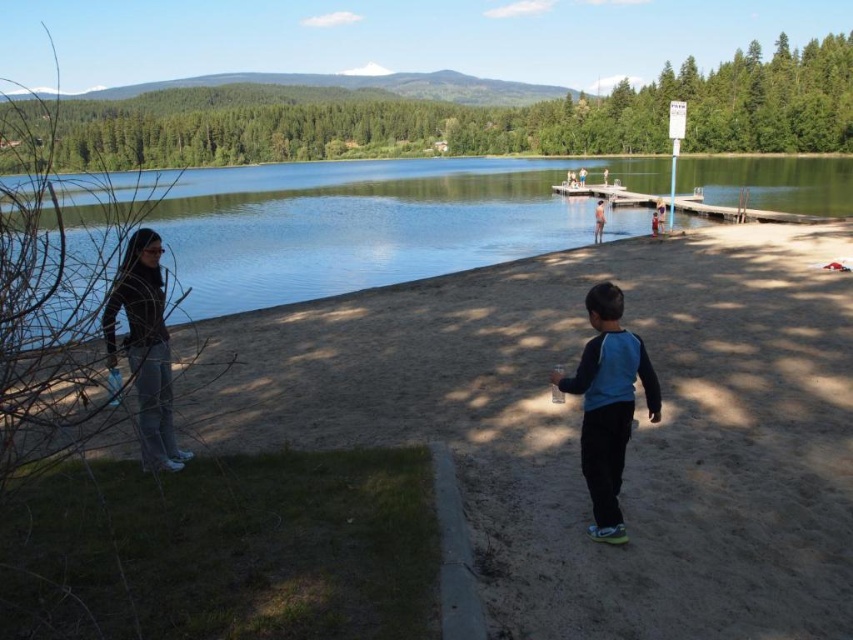
Question: Which of these objects is positioned farthest from the brown sandy beach at lower center?

Choices:
 (A) clear water at center
 (B) black matte jacket at lower left
 (C) blue fabric shirt at center

Answer: (A)

Question: Does clear water at center have a lesser width compared to black matte jacket at lower left?

Choices:
 (A) no
 (B) yes

Answer: (A)

Question: Which object appears farthest from the camera in this image?

Choices:
 (A) blue fabric shirt at center
 (B) black matte jacket at lower left
 (C) brown sandy beach at lower center
 (D) clear water at center

Answer: (A)

Question: Which point appears closest to the camera in this image?

Choices:
 (A) (675, 538)
 (B) (590, 378)
 (C) (325, 195)

Answer: (B)

Question: Is brown sandy beach at lower center bigger than black matte jacket at lower left?

Choices:
 (A) no
 (B) yes

Answer: (B)

Question: Does brown sandy beach at lower center appear on the right side of blue fabric shirt at center?

Choices:
 (A) no
 (B) yes

Answer: (A)